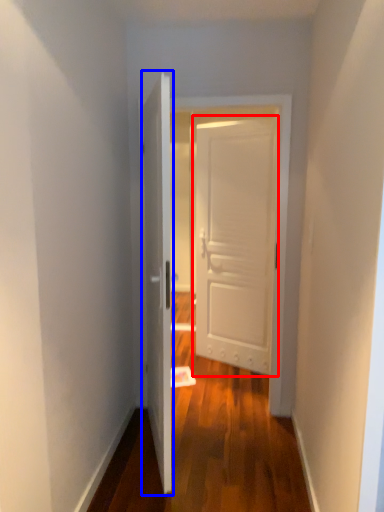
Question: Which object is further to the camera taking this photo, door (highlighted by a red box) or door (highlighted by a blue box)?

Choices:
 (A) door
 (B) door

Answer: (A)